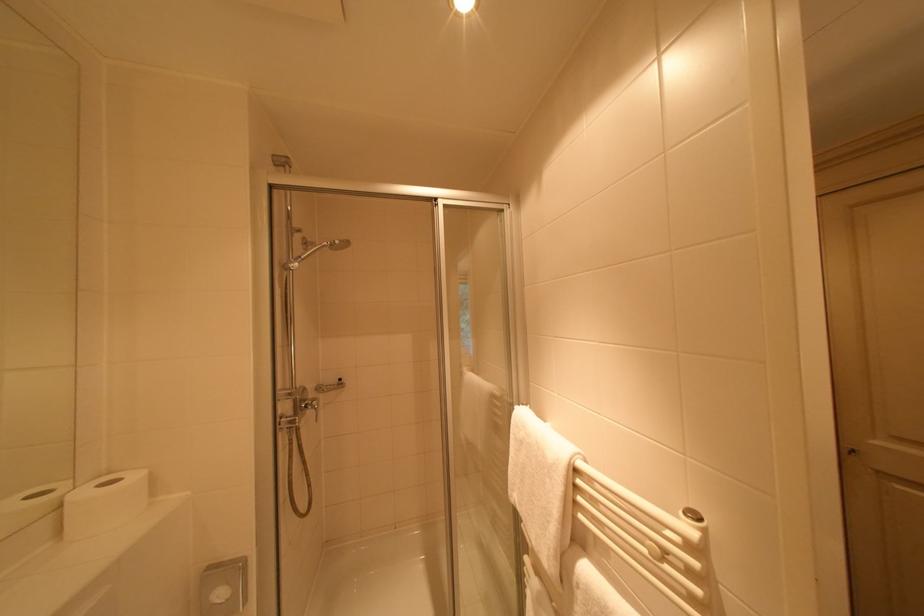
Where is `shower faucet handle`? This screenshot has height=616, width=924. shower faucet handle is located at coordinates (843, 543).